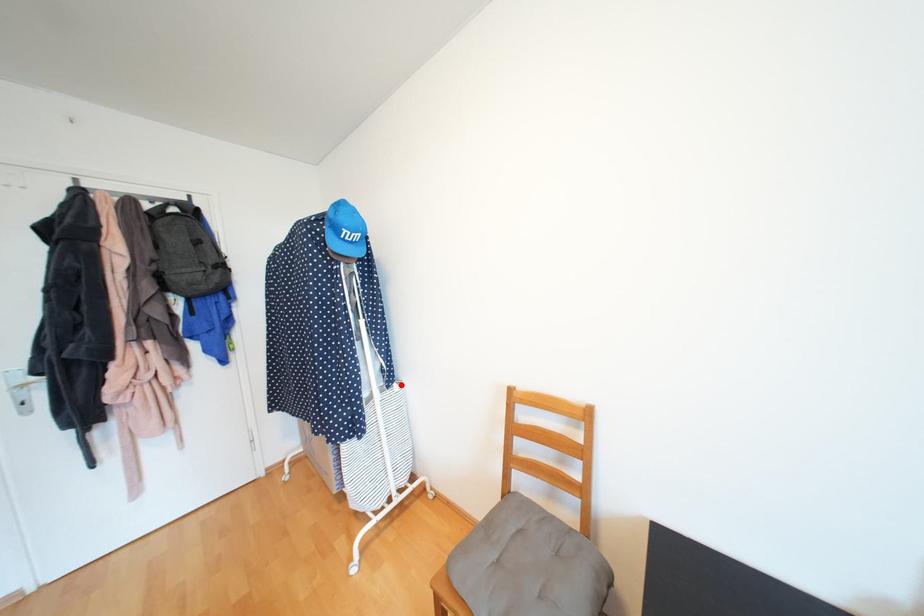
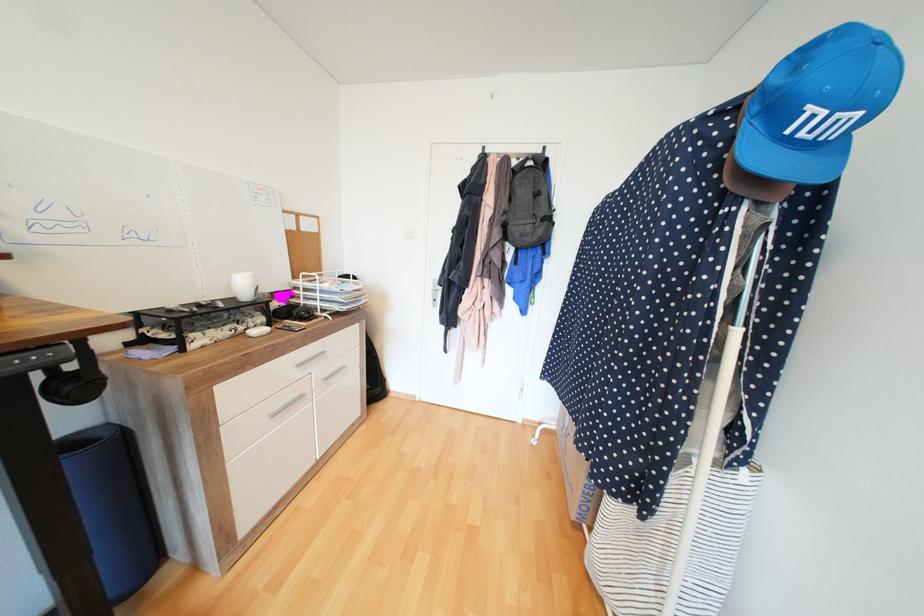
The point at the highlighted location is marked in the first image. Where is the corresponding point in the second image?

(750, 471)